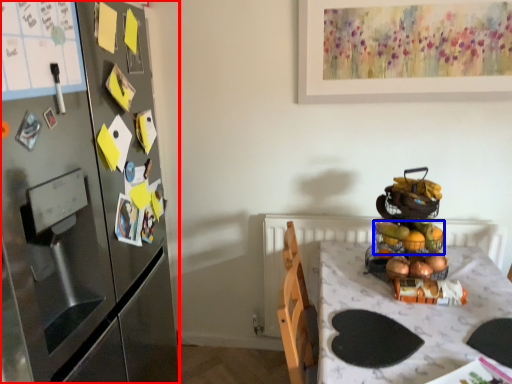
Question: Which object is further to the camera taking this photo, cabinetry (highlighted by a red box) or basket (highlighted by a blue box)?

Choices:
 (A) cabinetry
 (B) basket

Answer: (B)